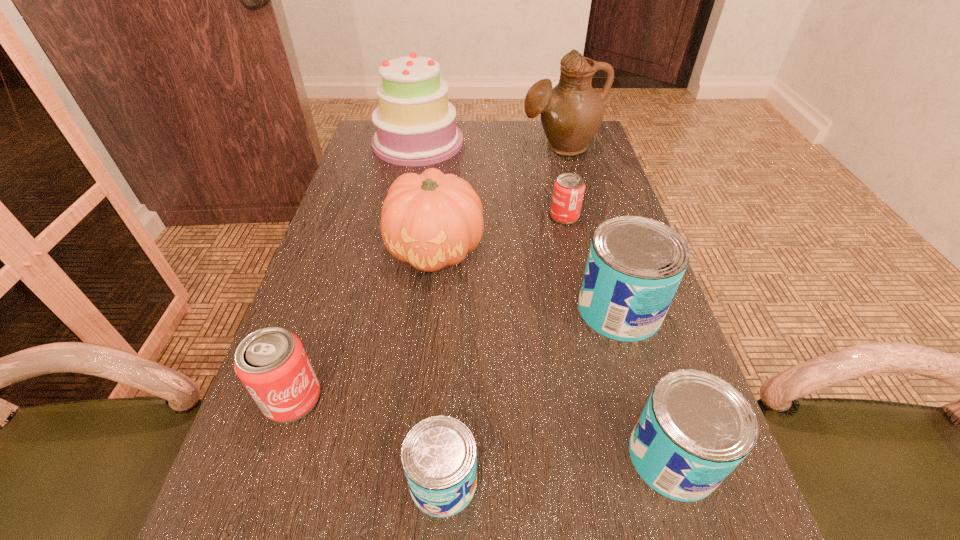
Choose which object is the fourth nearest neighbor to the farthest blue can. Please provide its 2D coordinates. Your answer should be formatted as a tuple, i.e. [(x, y)], where the tuple contains the x and y coordinates of a point satisfying the conditions above.

[(439, 457)]

Point out which can is positioned as the second nearest to the smallest blue can. Please provide its 2D coordinates. Your answer should be formatted as a tuple, i.e. [(x, y)], where the tuple contains the x and y coordinates of a point satisfying the conditions above.

[(695, 429)]

Identify which can is the third closest to the left red can. Please provide its 2D coordinates. Your answer should be formatted as a tuple, i.e. [(x, y)], where the tuple contains the x and y coordinates of a point satisfying the conditions above.

[(695, 429)]

I want to click on blue can that is the third closest to the bigger red can, so click(695, 429).

Identify the location of the closest blue can to the bigger red can. (439, 457).

This screenshot has height=540, width=960. Find the location of `vacant area in the image that satisfies the following two spatial constraints: 1. on the back side of the right red can; 2. on the left side of the nearer red can`. vacant area in the image that satisfies the following two spatial constraints: 1. on the back side of the right red can; 2. on the left side of the nearer red can is located at coordinates (353, 216).

This screenshot has height=540, width=960. I want to click on free space that satisfies the following two spatial constraints: 1. at the spout of the biggest blue can; 2. on the right side of the pitcher, so [x=604, y=310].

What are the coordinates of `blank area in the image that satisfies the following two spatial constraints: 1. on the back side of the farther red can; 2. on the right side of the leftmost blue can` in the screenshot? It's located at (458, 216).